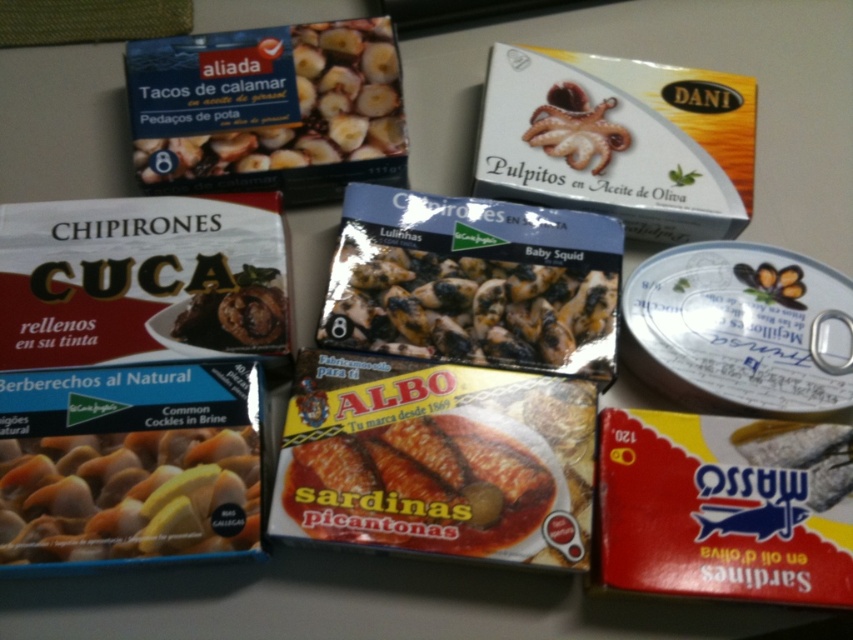
Question: Among these objects, which one is nearest to the camera?

Choices:
 (A) black matte baby squid at center
 (B) matte white cockles at lower left
 (C) matte cardboard box of tacos de calamar at upper left
 (D) yellowish matte sardines at center

Answer: (B)

Question: Can you confirm if matte cardboard box of tacos de calamar at upper left is positioned above matte white cockles at lower left?

Choices:
 (A) yes
 (B) no

Answer: (A)

Question: Estimate the real-world distances between objects in this image. Which object is farther from the yellowish matte sardines at center?

Choices:
 (A) black matte baby squid at center
 (B) matte cardboard box of tacos de calamar at upper left
 (C) matte white cockles at lower left

Answer: (B)

Question: Does matte cardboard box of tacos de calamar at upper left come in front of yellowish matte sardines at center?

Choices:
 (A) no
 (B) yes

Answer: (A)

Question: Which object is farther from the camera taking this photo?

Choices:
 (A) matte white cockles at lower left
 (B) yellowish matte sardines at center

Answer: (B)

Question: Is black matte baby squid at center thinner than yellowish matte sardines at center?

Choices:
 (A) yes
 (B) no

Answer: (B)